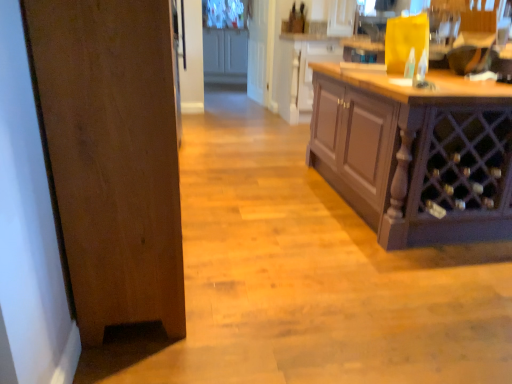
Question: Is matte wood cabinet at center, which is the 2th cabinetry from back to front, to the right of white glossy door at upper center from the viewer's perspective?

Choices:
 (A) yes
 (B) no

Answer: (A)

Question: Could you tell me if matte wood cabinet at center, which is the 2th cabinetry from back to front, is facing white glossy door at upper center?

Choices:
 (A) yes
 (B) no

Answer: (B)

Question: Can you confirm if matte wood cabinet at center, the second cabinetry viewed from the top, is taller than white glossy door at upper center?

Choices:
 (A) yes
 (B) no

Answer: (B)

Question: From a real-world perspective, does matte wood cabinet at center, arranged as the 2th cabinetry when viewed from the front, stand above white glossy door at upper center?

Choices:
 (A) yes
 (B) no

Answer: (B)

Question: Is matte wood cabinet at center, which appears as the second cabinetry when viewed from the right, outside white glossy door at upper center?

Choices:
 (A) yes
 (B) no

Answer: (A)

Question: Choose the correct answer: Is matte wood cabinet at center, which appears as the second cabinetry when viewed from the right, inside white glossy door at upper center or outside it?

Choices:
 (A) outside
 (B) inside

Answer: (A)

Question: In terms of size, does matte wood cabinet at center, arranged as the 2th cabinetry when viewed from the left, appear bigger or smaller than white glossy door at upper center?

Choices:
 (A) big
 (B) small

Answer: (A)

Question: Based on their positions, is matte wood cabinet at center, arranged as the 2th cabinetry when viewed from the left, located to the left or right of white glossy door at upper center?

Choices:
 (A) right
 (B) left

Answer: (A)

Question: Considering the positions of point (279, 86) and point (248, 62), is point (279, 86) closer or farther from the camera than point (248, 62)?

Choices:
 (A) closer
 (B) farther

Answer: (A)

Question: Is point (122, 286) positioned closer to the camera than point (217, 77)?

Choices:
 (A) closer
 (B) farther

Answer: (A)

Question: Looking at the image, does wooden door at left seem bigger or smaller compared to matte gray cabinets at upper center, which is the 1th cabinetry in top-to-bottom order?

Choices:
 (A) big
 (B) small

Answer: (A)

Question: Choose the correct answer: Is wooden door at left inside matte gray cabinets at upper center, placed as the 1th cabinetry when sorted from back to front, or outside it?

Choices:
 (A) outside
 (B) inside

Answer: (A)

Question: In terms of width, does wooden door at left look wider or thinner when compared to matte gray cabinets at upper center, which is the 3th cabinetry from front to back?

Choices:
 (A) thin
 (B) wide

Answer: (A)

Question: Considering their positions, is brown wood cabinet at right, the third cabinetry in the left-to-right sequence, located in front of or behind white glossy door at upper center?

Choices:
 (A) behind
 (B) front

Answer: (B)

Question: From the image's perspective, is brown wood cabinet at right, acting as the 1th cabinetry starting from the right, positioned above or below white glossy door at upper center?

Choices:
 (A) above
 (B) below

Answer: (B)